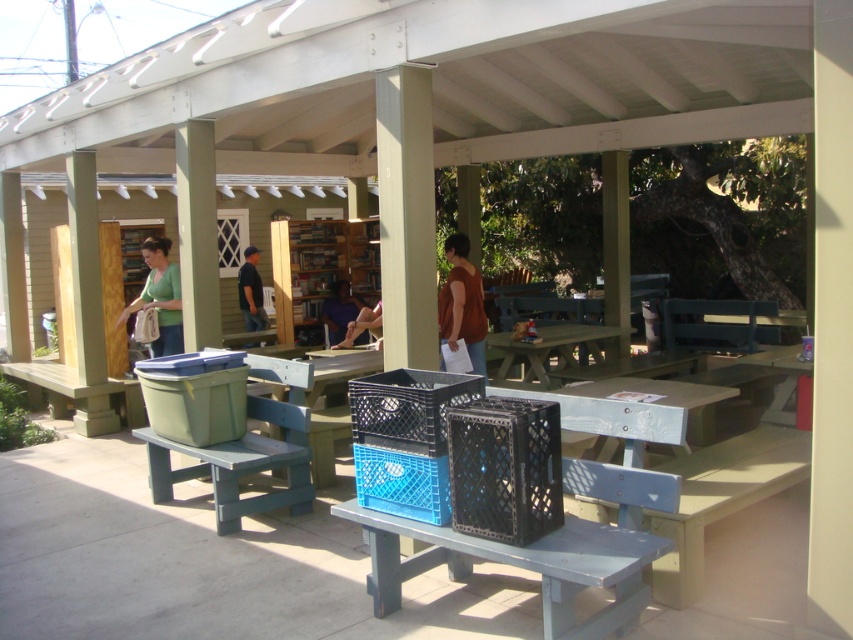
Does green painted wood bench at left appear on the right side of green plastic picnic table at center?

Incorrect, green painted wood bench at left is not on the right side of green plastic picnic table at center.

Can you confirm if green painted wood bench at left is shorter than green plastic picnic table at center?

No, green painted wood bench at left is not shorter than green plastic picnic table at center.

The image size is (853, 640). In order to click on green painted wood bench at left in this screenshot , I will do `click(73, 396)`.

The width and height of the screenshot is (853, 640). I want to click on green painted wood bench at left, so click(73, 396).

Who is higher up, brown matte shirt at center or matte purple shirt at center?

brown matte shirt at center

Does brown matte shirt at center have a larger size compared to matte purple shirt at center?

No, brown matte shirt at center is not bigger than matte purple shirt at center.

What do you see at coordinates (462, 304) in the screenshot?
I see `brown matte shirt at center` at bounding box center [462, 304].

At what (x,y) coordinates should I click in order to perform the action: click on brown matte shirt at center. Please return your answer as a coordinate pair (x, y). This screenshot has width=853, height=640. Looking at the image, I should click on (462, 304).

Does blue plastic table at center have a larger size compared to brown leather jacket at center?

Correct, blue plastic table at center is larger in size than brown leather jacket at center.

From the picture: Does blue plastic table at center appear on the left side of brown leather jacket at center?

Indeed, blue plastic table at center is positioned on the left side of brown leather jacket at center.

Measure the distance between blue plastic table at center and camera.

blue plastic table at center and camera are 21.14 feet apart.

Where is `blue plastic table at center`? The image size is (853, 640). blue plastic table at center is located at coordinates (312, 372).